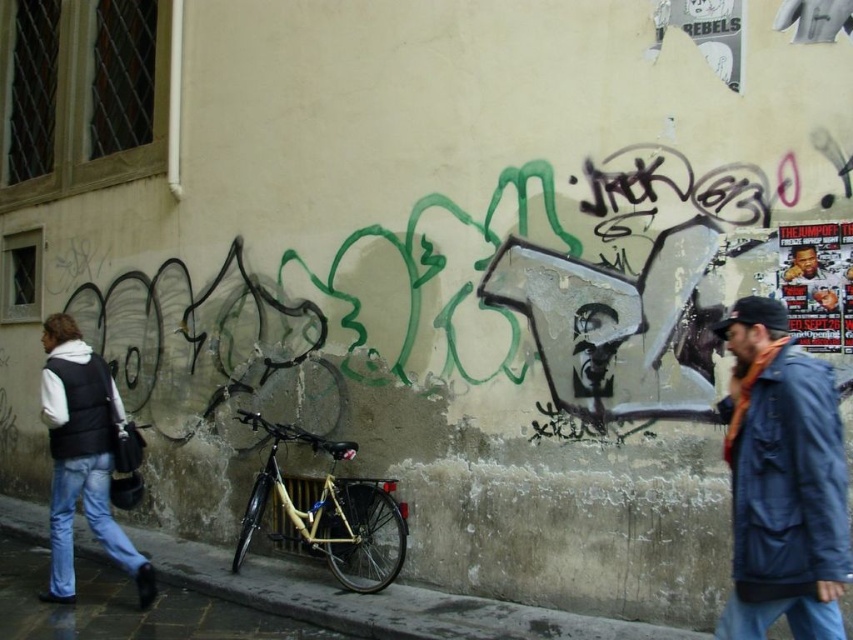
Who is more distant from viewer, (71, 552) or (306, 433)?

The point (306, 433) is more distant.

Between black matte vest at left and gold metallic bicycle at center, which one has less height?

gold metallic bicycle at center

Between point (67, 525) and point (381, 520), which one is positioned in front?

Point (67, 525) is more forward.

Image resolution: width=853 pixels, height=640 pixels. In order to click on black matte vest at left in this screenshot , I will do `click(82, 456)`.

Consider the image. Can you confirm if concrete sidewalk at center is positioned below gold metallic bicycle at center?

Correct, concrete sidewalk at center is located below gold metallic bicycle at center.

Measure the distance between concrete sidewalk at center and camera.

A distance of 15.32 feet exists between concrete sidewalk at center and camera.

This screenshot has height=640, width=853. Identify the location of concrete sidewalk at center. (376, 600).

Locate an element on the screen. concrete sidewalk at center is located at coordinates (376, 600).

Who is lower down, concrete sidewalk at center or black matte vest at left?

concrete sidewalk at center is lower down.

Between point (253, 570) and point (86, 452), which one is positioned behind?

The point (253, 570) is behind.

Between point (277, 609) and point (106, 364), which one is positioned in front?

Positioned in front is point (277, 609).

In order to click on concrete sidewalk at center in this screenshot , I will do `click(376, 600)`.